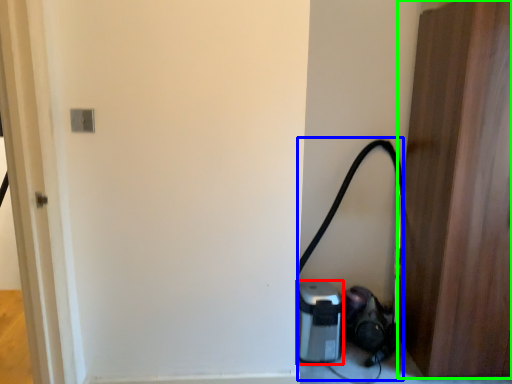
Question: Considering the real-world distances, which object is farthest from appliance (highlighted by a red box)? garden hose (highlighted by a blue box) or door (highlighted by a green box)?

Choices:
 (A) garden hose
 (B) door

Answer: (B)